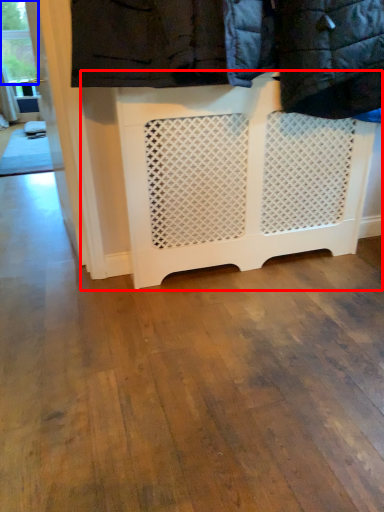
Question: Which object appears closest to the camera in this image, furniture (highlighted by a red box) or window frame (highlighted by a blue box)?

Choices:
 (A) furniture
 (B) window frame

Answer: (A)